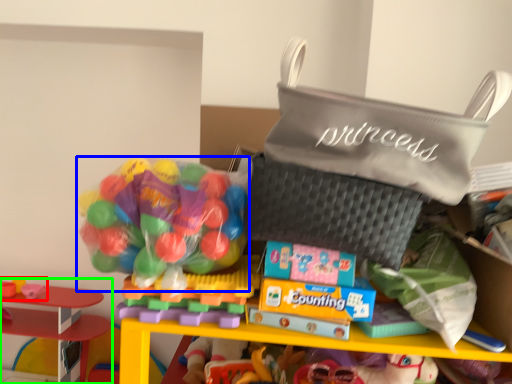
Question: Which is farther away from toy (highlighted by a red box)? candy (highlighted by a blue box) or toy (highlighted by a green box)?

Choices:
 (A) candy
 (B) toy

Answer: (A)